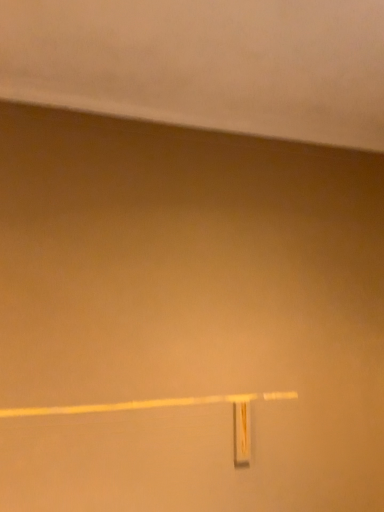
At what (x,y) coordinates should I click in order to perform the action: click on yellow plastic power plug at center. Please return your answer as a coordinate pair (x, y). Image resolution: width=384 pixels, height=512 pixels. Looking at the image, I should click on [242, 433].

Looking at this image, in order to face yellow plastic power plug at center, should I rotate leftwards or rightwards?

To align with it, rotate right about 6.963°.

What is the approximate height of yellow plastic power plug at center?

yellow plastic power plug at center is 7.99 inches tall.

What do you see at coordinates (242, 433) in the screenshot? I see `yellow plastic power plug at center` at bounding box center [242, 433].

Identify the location of yellow plastic power plug at center. (242, 433).